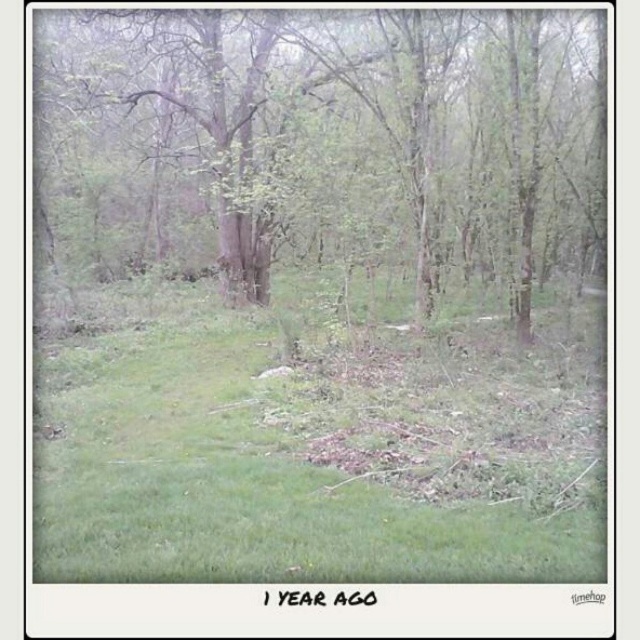
Question: Is green grassy at center smaller than green leafy tree at center?

Choices:
 (A) yes
 (B) no

Answer: (A)

Question: Is green grassy at center positioned in front of green leafy tree at center?

Choices:
 (A) no
 (B) yes

Answer: (B)

Question: Can you confirm if green grassy at center is thinner than green leafy tree at center?

Choices:
 (A) no
 (B) yes

Answer: (B)

Question: Among these points, which one is nearest to the camera?

Choices:
 (A) (99, 218)
 (B) (60, 385)

Answer: (B)